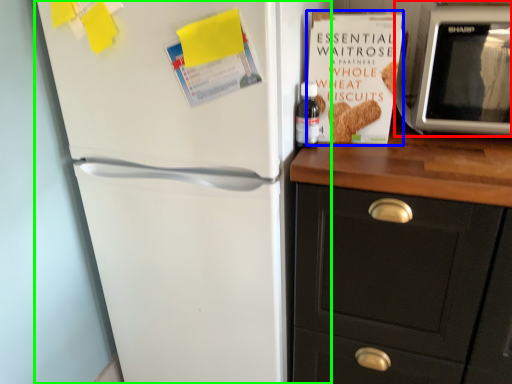
Question: Which object is the farthest from microwave oven (highlighted by a red box)? Choose among these: paperback book (highlighted by a blue box) or refrigerator (highlighted by a green box).

Choices:
 (A) paperback book
 (B) refrigerator

Answer: (B)